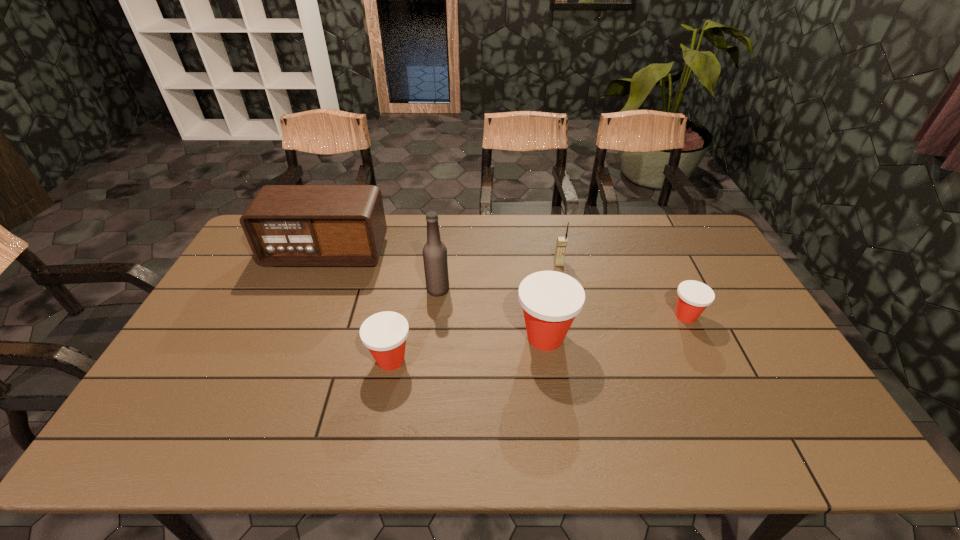
Please show where to add a Dixie cup on the left while keeping spacing even. Please provide its 2D coordinates. Your answer should be formatted as a tuple, i.e. [(x, y)], where the tuple contains the x and y coordinates of a point satisfying the conditions above.

[(220, 385)]